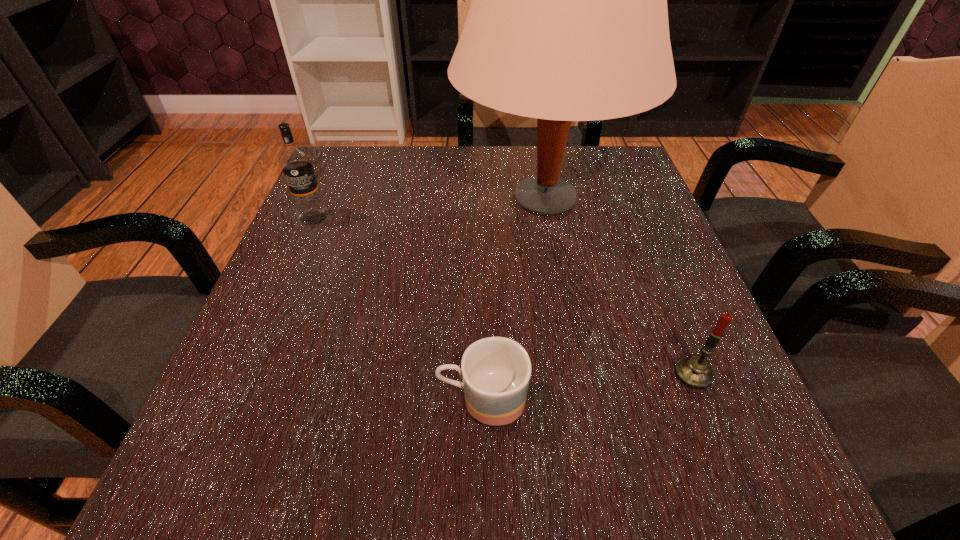
Where is `lampshade`? The image size is (960, 540). lampshade is located at coordinates (568, 22).

What are the coordinates of `the leftmost object` in the screenshot? It's located at (295, 162).

Find the location of a particular element. The height and width of the screenshot is (540, 960). the third shortest object is located at coordinates (295, 162).

You are a GUI agent. You are given a task and a screenshot of the screen. Output one action in this format:
    pyautogui.click(x=<x>, y=<y>)
    Task: Click on the candle
    This screenshot has height=540, width=960.
    Given the screenshot: What is the action you would take?
    pyautogui.click(x=694, y=371)

You are a GUI agent. You are given a task and a screenshot of the screen. Output one action in this format:
    pyautogui.click(x=<x>, y=<y>)
    Task: Click on the mug
    The height and width of the screenshot is (540, 960).
    Given the screenshot: What is the action you would take?
    pyautogui.click(x=496, y=371)

The height and width of the screenshot is (540, 960). I want to click on vacant space located on the front-facing side of the lampshade, so click(426, 199).

Find the location of a particular element. free space located on the front-facing side of the lampshade is located at coordinates (409, 199).

Find the location of a particular element. free space located on the front-facing side of the lampshade is located at coordinates (377, 199).

Identify the location of free point located 0.390m on the label of the second tallest object. (234, 399).

In order to click on free spot located on the left of the candle in this screenshot , I will do `click(629, 374)`.